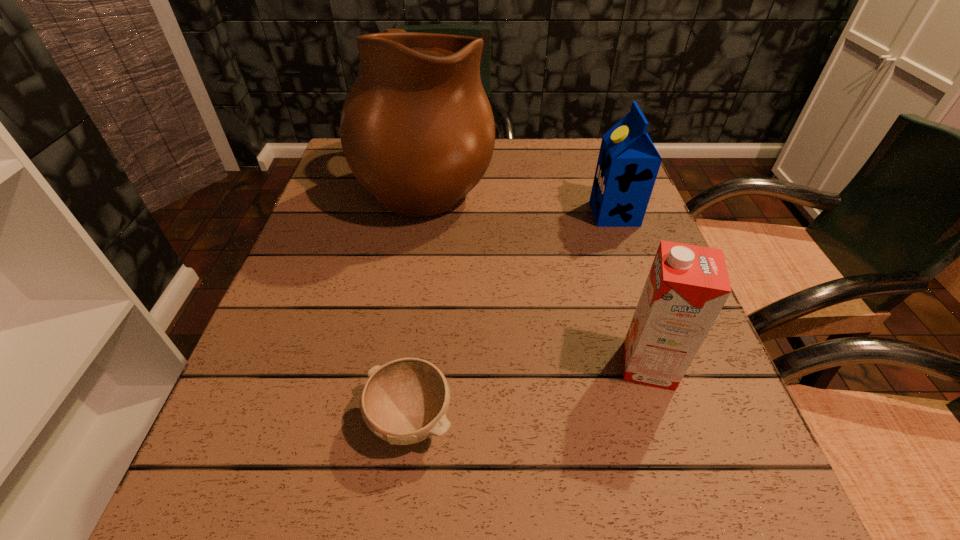
Find the location of `free spot between the nearer carton and the farther carton`. free spot between the nearer carton and the farther carton is located at coordinates [x=632, y=289].

Image resolution: width=960 pixels, height=540 pixels. I want to click on free area in between the bowl and the farther carton, so point(513,316).

The width and height of the screenshot is (960, 540). Find the location of `free space between the farther carton and the tallest object`. free space between the farther carton and the tallest object is located at coordinates (520, 198).

Locate an element on the screen. Image resolution: width=960 pixels, height=540 pixels. unoccupied area between the farther carton and the shortest object is located at coordinates (513, 316).

The height and width of the screenshot is (540, 960). Find the location of `empty space between the nearer carton and the shortest object`. empty space between the nearer carton and the shortest object is located at coordinates (530, 392).

I want to click on empty location between the shortest object and the tallest object, so click(420, 301).

Identify the location of vacant area between the tallest object and the shortest object. The image size is (960, 540). (420, 301).

The image size is (960, 540). What are the coordinates of `free spot between the cream pitcher and the nearer carton` in the screenshot? It's located at (538, 274).

This screenshot has height=540, width=960. I want to click on object that is the third closest to the farther carton, so 405,401.

Identify which object is the nearest to the bowl. Please provide its 2D coordinates. Your answer should be formatted as a tuple, i.e. [(x, y)], where the tuple contains the x and y coordinates of a point satisfying the conditions above.

[(687, 286)]